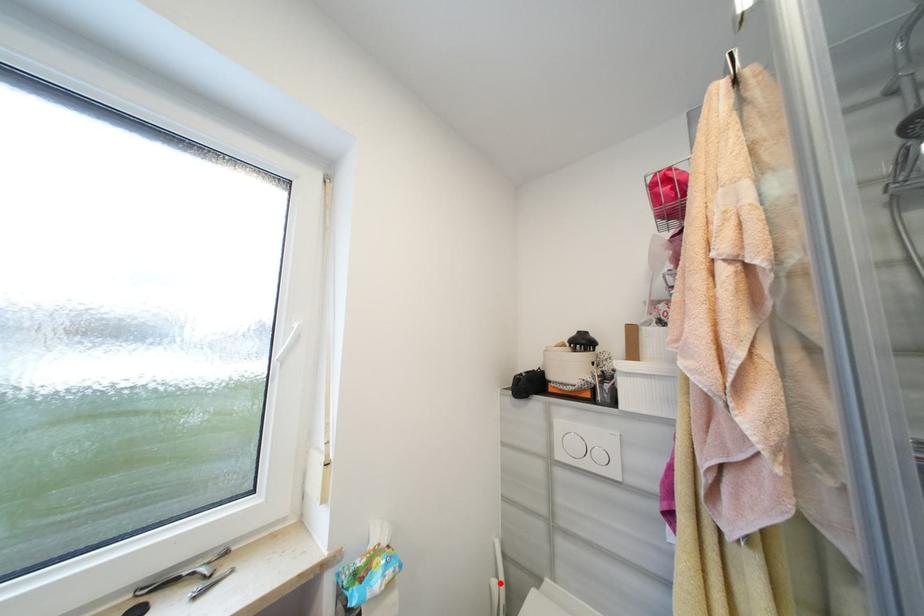
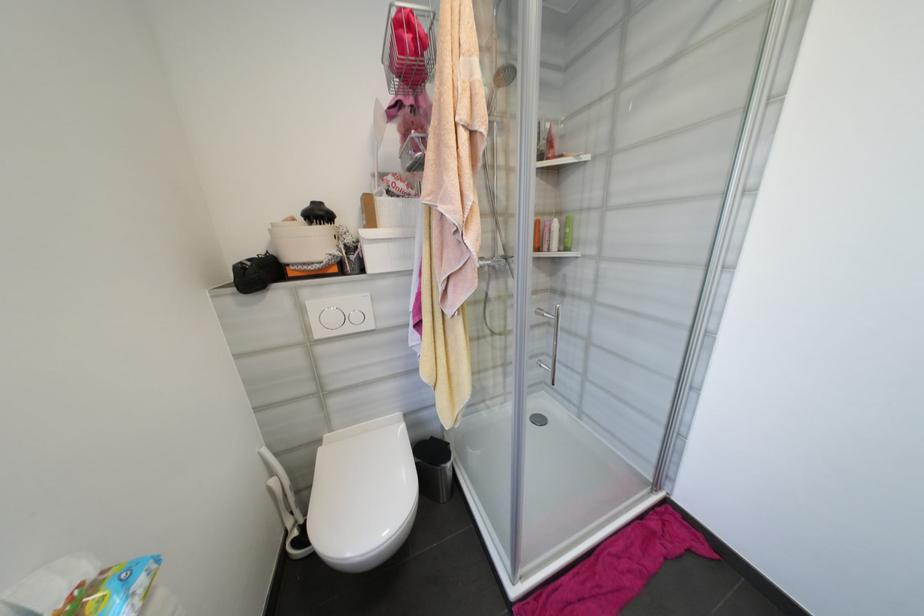
In the second image, find the point that corresponds to the highlighted location in the first image.

(277, 482)